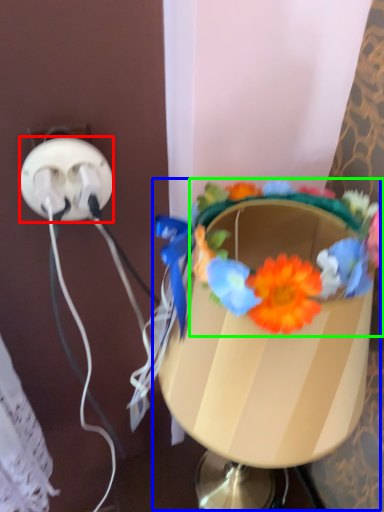
Question: Estimate the real-world distances between objects in this image. Which object is closer to power plugs and sockets (highlighted by a red box), table lamp (highlighted by a blue box) or flower (highlighted by a green box)?

Choices:
 (A) table lamp
 (B) flower

Answer: (B)